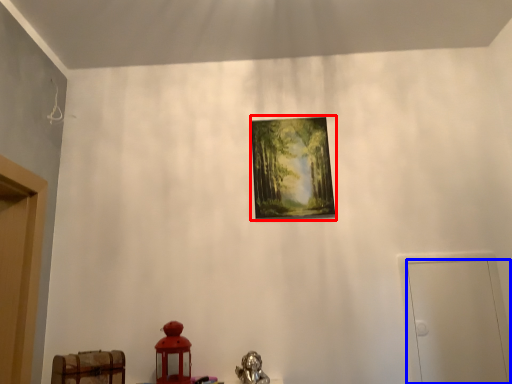
Question: Which object is closer to the camera taking this photo, picture frame (highlighted by a red box) or door (highlighted by a blue box)?

Choices:
 (A) picture frame
 (B) door

Answer: (B)